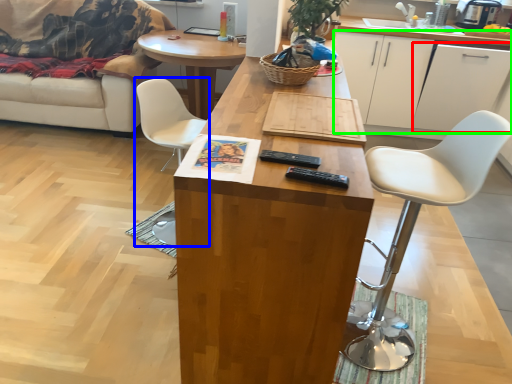
Question: Considering the real-world distances, which object is farthest from cabinetry (highlighted by a red box)? chair (highlighted by a blue box) or cabinetry (highlighted by a green box)?

Choices:
 (A) chair
 (B) cabinetry

Answer: (A)